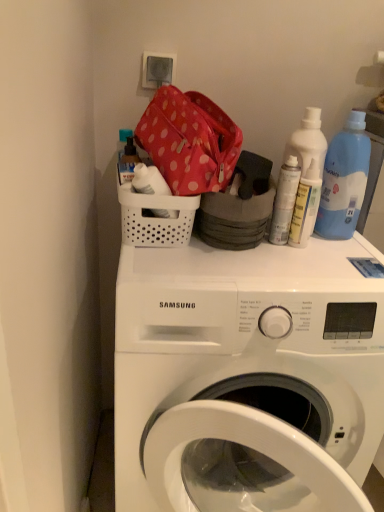
Question: Can we say polka dot fabric bag at upper center lies outside white plastic washing machine at upper center?

Choices:
 (A) no
 (B) yes

Answer: (B)

Question: Considering the relative sizes of polka dot fabric bag at upper center and white plastic washing machine at upper center in the image provided, is polka dot fabric bag at upper center wider than white plastic washing machine at upper center?

Choices:
 (A) no
 (B) yes

Answer: (A)

Question: Can you confirm if polka dot fabric bag at upper center is positioned to the right of white plastic washing machine at upper center?

Choices:
 (A) yes
 (B) no

Answer: (B)

Question: Does polka dot fabric bag at upper center appear on the left side of white plastic washing machine at upper center?

Choices:
 (A) no
 (B) yes

Answer: (B)

Question: Is polka dot fabric bag at upper center closer to the viewer compared to white plastic washing machine at upper center?

Choices:
 (A) no
 (B) yes

Answer: (A)

Question: Is polka dot fabric bag at upper center taller than white plastic washing machine at upper center?

Choices:
 (A) yes
 (B) no

Answer: (B)

Question: Is polka dot fabric bag at upper center taller than white plastic basket at upper center?

Choices:
 (A) no
 (B) yes

Answer: (B)

Question: Does polka dot fabric bag at upper center appear on the left side of white plastic basket at upper center?

Choices:
 (A) yes
 (B) no

Answer: (B)

Question: Is polka dot fabric bag at upper center aimed at white plastic basket at upper center?

Choices:
 (A) yes
 (B) no

Answer: (B)

Question: Is polka dot fabric bag at upper center facing away from white plastic basket at upper center?

Choices:
 (A) yes
 (B) no

Answer: (B)

Question: Considering the relative sizes of polka dot fabric bag at upper center and white plastic basket at upper center in the image provided, is polka dot fabric bag at upper center shorter than white plastic basket at upper center?

Choices:
 (A) no
 (B) yes

Answer: (A)

Question: Is the position of polka dot fabric bag at upper center less distant than that of white plastic basket at upper center?

Choices:
 (A) no
 (B) yes

Answer: (B)

Question: Is white plastic washing machine at upper center at the left side of blue plastic bottle at upper right?

Choices:
 (A) no
 (B) yes

Answer: (B)